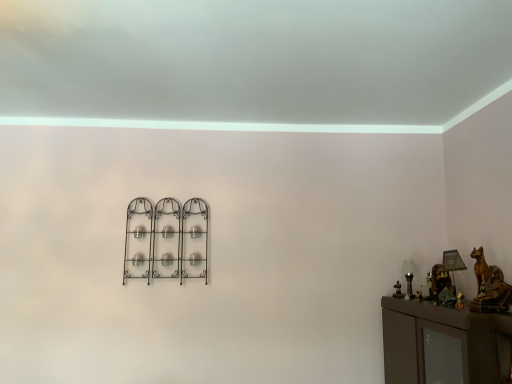
Question: Considering the relative positions of metallic gold table lamp at right, which appears as the second table lamp when viewed from the left, and white glass table lamp at right, which ranks as the 1th table lamp in back-to-front order, in the image provided, is metallic gold table lamp at right, which appears as the second table lamp when viewed from the left, to the left of white glass table lamp at right, which ranks as the 1th table lamp in back-to-front order, from the viewer's perspective?

Choices:
 (A) no
 (B) yes

Answer: (A)

Question: Are metallic gold table lamp at right, the 1th table lamp positioned from the front, and white glass table lamp at right, the 2th table lamp when ordered from front to back, beside each other?

Choices:
 (A) yes
 (B) no

Answer: (B)

Question: Is metallic gold table lamp at right, placed as the second table lamp when sorted from back to front, wider than white glass table lamp at right, the 2th table lamp when ordered from front to back?

Choices:
 (A) no
 (B) yes

Answer: (B)

Question: Can you confirm if metallic gold table lamp at right, placed as the second table lamp when sorted from back to front, is smaller than white glass table lamp at right, which is counted as the first table lamp, starting from the left?

Choices:
 (A) yes
 (B) no

Answer: (B)

Question: From the image's perspective, is metallic gold table lamp at right, which appears as the second table lamp when viewed from the left, on white glass table lamp at right, the 2th table lamp when ordered from front to back?

Choices:
 (A) no
 (B) yes

Answer: (B)

Question: Looking at the image, does white glass table lamp at right, arranged as the second table lamp when viewed from the right, seem bigger or smaller compared to metallic gold table lamp at right, placed as the second table lamp when sorted from back to front?

Choices:
 (A) big
 (B) small

Answer: (B)

Question: Is white glass table lamp at right, arranged as the second table lamp when viewed from the right, inside or outside of metallic gold table lamp at right, placed as the second table lamp when sorted from back to front?

Choices:
 (A) outside
 (B) inside

Answer: (A)

Question: Does point (411, 261) appear closer or farther from the camera than point (453, 264)?

Choices:
 (A) closer
 (B) farther

Answer: (B)

Question: From a real-world perspective, is white glass table lamp at right, which is counted as the first table lamp, starting from the left, above or below metallic gold table lamp at right, marked as the first table lamp in a right-to-left arrangement?

Choices:
 (A) above
 (B) below

Answer: (B)

Question: In terms of width, does black wrought iron candle holder at center look wider or thinner when compared to white glass table lamp at right, arranged as the second table lamp when viewed from the right?

Choices:
 (A) thin
 (B) wide

Answer: (A)

Question: Is black wrought iron candle holder at center to the left or to the right of white glass table lamp at right, which is counted as the first table lamp, starting from the left, in the image?

Choices:
 (A) right
 (B) left

Answer: (B)

Question: From the image's perspective, is black wrought iron candle holder at center positioned above or below white glass table lamp at right, which is counted as the first table lamp, starting from the left?

Choices:
 (A) below
 (B) above

Answer: (B)

Question: Does point (131, 235) appear closer or farther from the camera than point (402, 273)?

Choices:
 (A) farther
 (B) closer

Answer: (B)

Question: Which is correct: metallic gold table lamp at right, placed as the second table lamp when sorted from back to front, is inside black wrought iron candle holder at center, or outside of it?

Choices:
 (A) inside
 (B) outside

Answer: (B)

Question: Is metallic gold table lamp at right, placed as the second table lamp when sorted from back to front, taller or shorter than black wrought iron candle holder at center?

Choices:
 (A) short
 (B) tall

Answer: (A)